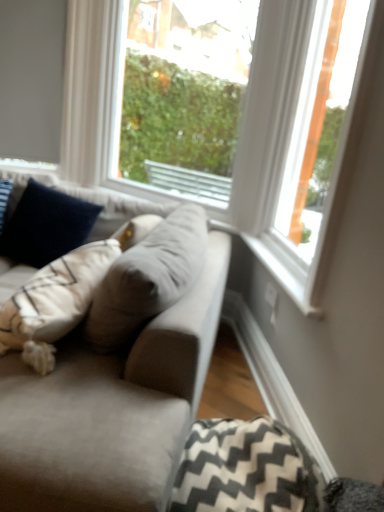
In order to click on vacant location below white wood frame at upper right, which is counted as the 2th window, starting from the left (from a real-world perspective) in this screenshot , I will do `click(271, 260)`.